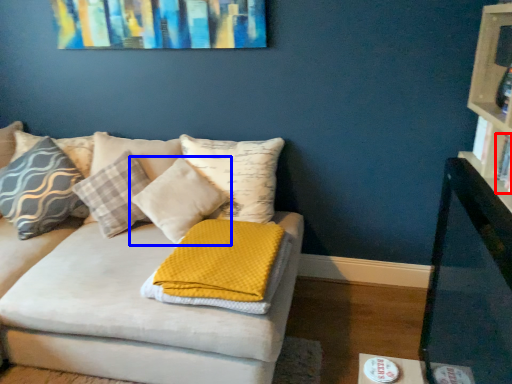
Question: Among these objects, which one is nearest to the camera, book (highlighted by a red box) or pillow (highlighted by a blue box)?

Choices:
 (A) book
 (B) pillow

Answer: (A)